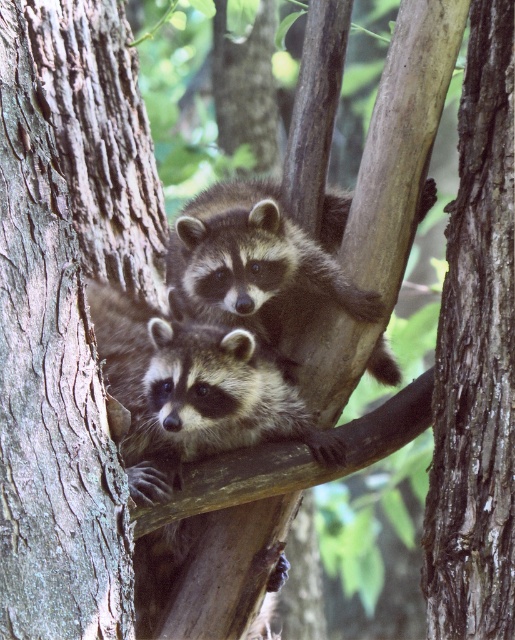
Question: In this image, where is smooth brown bark at left located relative to brown rough bark tree trunk at center?

Choices:
 (A) right
 (B) left

Answer: (B)

Question: Can you confirm if smooth brown bark at left is thinner than dark brown fur raccoon at center?

Choices:
 (A) yes
 (B) no

Answer: (A)

Question: Which point is closer to the camera taking this photo?

Choices:
 (A) (42, 292)
 (B) (270, 273)
 (C) (484, 342)

Answer: (A)

Question: Which object is positioned closest to the smooth brown bark at left?

Choices:
 (A) dark brown fur raccoon at center
 (B) brown rough bark tree trunk at center

Answer: (A)

Question: Can you confirm if smooth brown bark at left is wider than dark brown fur raccoon at center?

Choices:
 (A) yes
 (B) no

Answer: (B)

Question: Which point appears farthest from the camera in this image?

Choices:
 (A) (260, 298)
 (B) (60, 326)

Answer: (A)